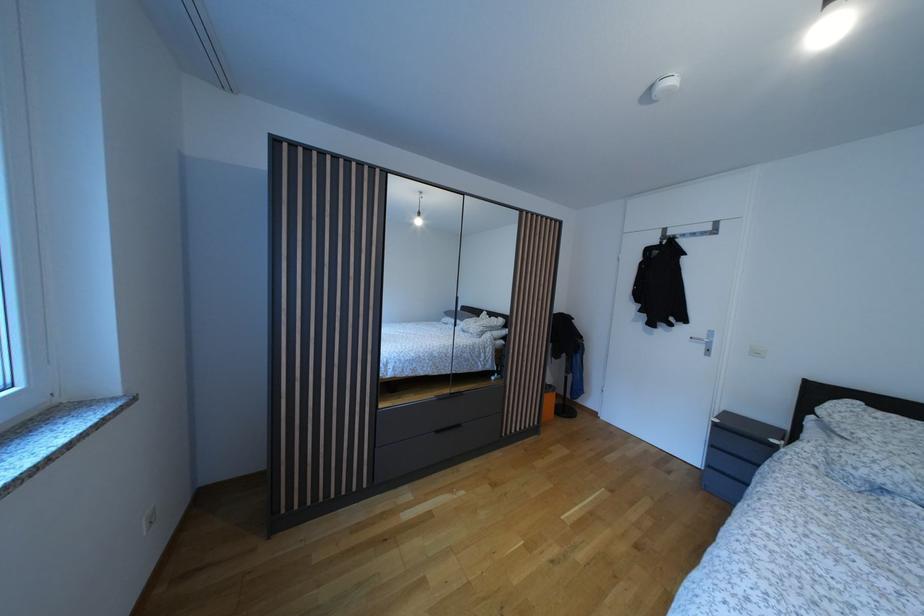
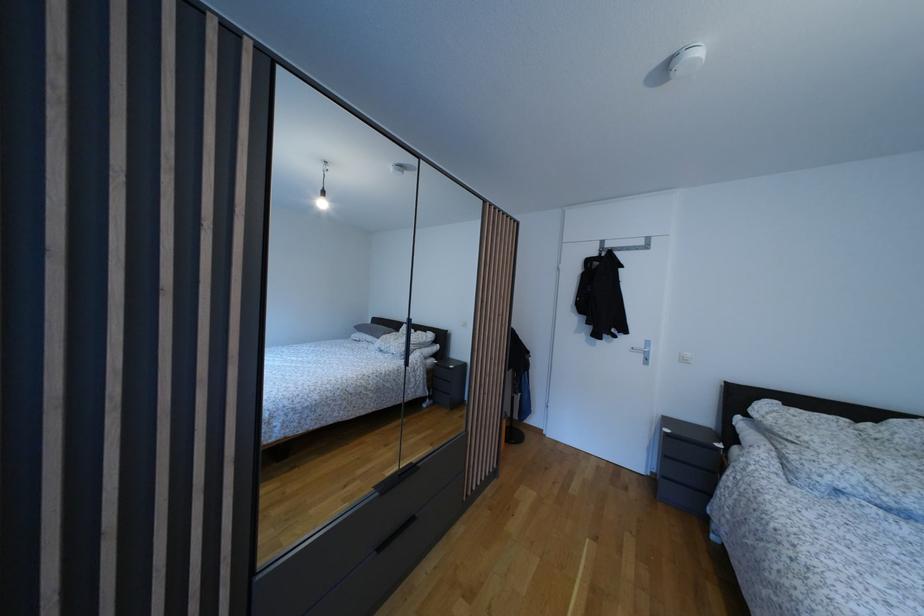
Question: In a continuous first-person perspective shot, in which direction is the camera moving?

Choices:
 (A) Left
 (B) Right
 (C) Forward
 (D) Backward

Answer: (C)